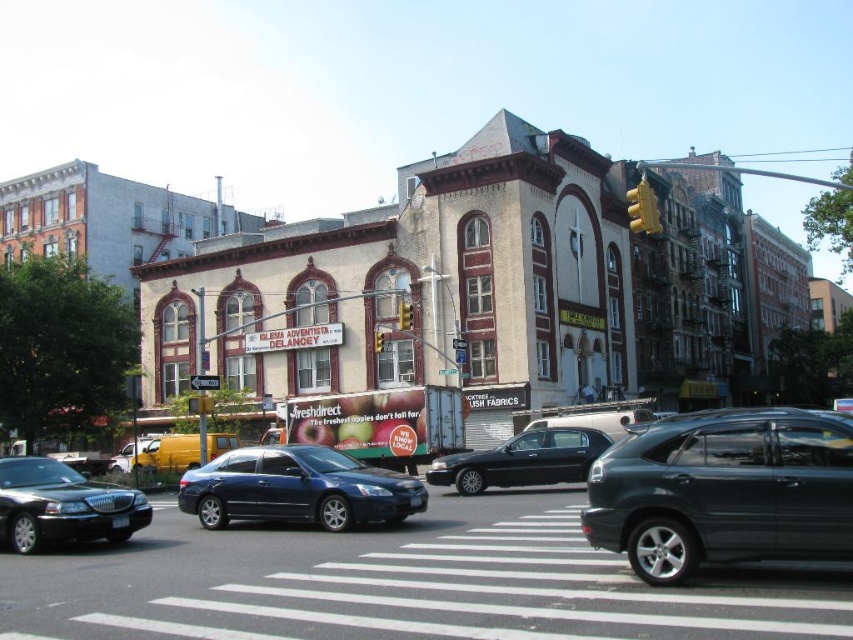
You are a pedestrian standing at the crosswalk near the church. You see the white asphalt at center and the metallic silver car at lower left. Which object is positioned to the right of the other?

The white asphalt at center is to the right of the metallic silver car at lower left.

You are standing at the intersection in front of the Iglesia Adventista de Delancey. You notice two points marked on the ground. The first point is at coordinates point (579,428) and the second is at point (383,336). If you want to place a small traffic cone closer to the camera, which point should you choose?

You should choose point (579,428) because it is closer to the camera than point (383,336).

You are a pedestrian standing at the crosswalk near the church. You see the white asphalt at center and the metallic silver car at lower left. Which object is lower in height?

The white asphalt at center has a lesser height compared to the metallic silver car at lower left, so the white asphalt at center is lower in height.